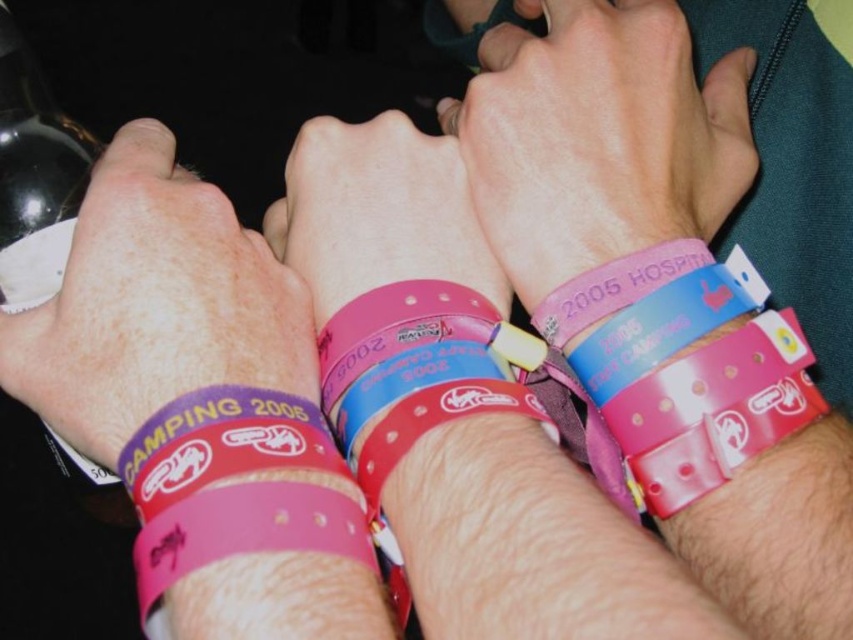
Where is `pink rubber wristband at center`? pink rubber wristband at center is located at coordinates (599, 138).

Which is below, pink rubber wristband at center or purple matte wristband at center?

purple matte wristband at center is below.

Which is behind, point (733, 189) or point (74, 292)?

Point (733, 189)

The height and width of the screenshot is (640, 853). In order to click on pink rubber wristband at center in this screenshot , I will do point(599,138).

Which of these two, pink rubber wristband at center or pink rubber wristband at lower center, stands taller?

Standing taller between the two is pink rubber wristband at center.

Who is positioned more to the right, pink rubber wristband at center or pink rubber wristband at lower center?

From the viewer's perspective, pink rubber wristband at center appears more on the right side.

Does point (608, 97) come closer to viewer compared to point (325, 547)?

No, it is not.

The width and height of the screenshot is (853, 640). Identify the location of pink rubber wristband at center. (599, 138).

Can you confirm if pink rubber wristband at center is positioned above black matte bottle at upper left?

Indeed, pink rubber wristband at center is positioned over black matte bottle at upper left.

Is pink rubber wristband at center to the right of black matte bottle at upper left from the viewer's perspective?

Yes, pink rubber wristband at center is to the right of black matte bottle at upper left.

What are the coordinates of `pink rubber wristband at center` in the screenshot? It's located at (599, 138).